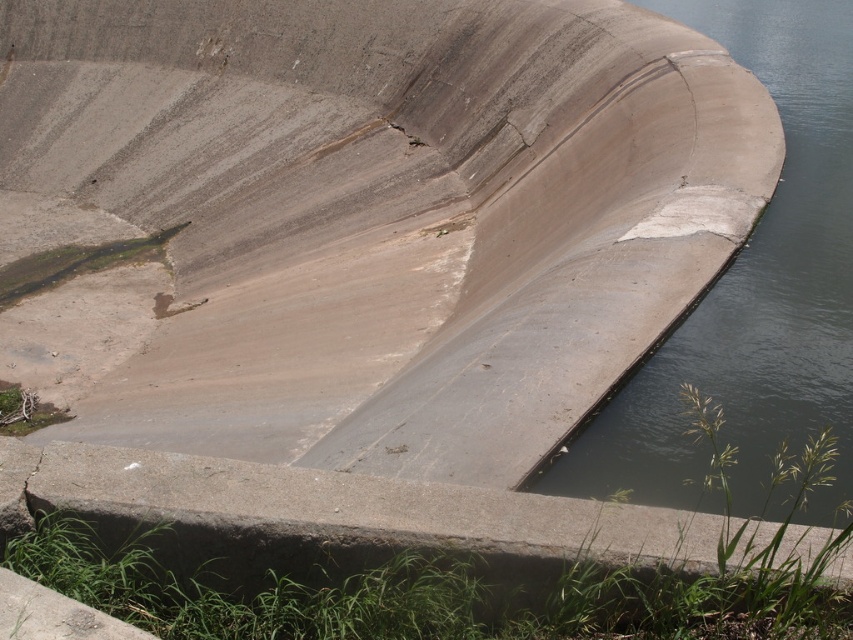
Between point (73, 184) and point (154, 481), which one is positioned behind?

Positioned behind is point (73, 184).

Where is `gray concrete dam at center`? The width and height of the screenshot is (853, 640). gray concrete dam at center is located at coordinates (413, 179).

Is gray concrete dam at center further to camera compared to gray concrete waterway at center-right?

That is False.

You are a GUI agent. You are given a task and a screenshot of the screen. Output one action in this format:
    pyautogui.click(x=<x>, y=<y>)
    Task: Click on the gray concrete dam at center
    
    Given the screenshot: What is the action you would take?
    pyautogui.click(x=413, y=179)

The width and height of the screenshot is (853, 640). What do you see at coordinates (413, 179) in the screenshot? I see `gray concrete dam at center` at bounding box center [413, 179].

Identify the location of gray concrete dam at center. (413, 179).

Which is in front, point (693, 330) or point (535, 515)?

Positioned in front is point (535, 515).

Describe the element at coordinates (751, 292) in the screenshot. I see `gray concrete waterway at center-right` at that location.

Who is more forward, (540,480) or (338,499)?

Point (338,499) is more forward.

Where is `gray concrete waterway at center-right`? gray concrete waterway at center-right is located at coordinates (751, 292).